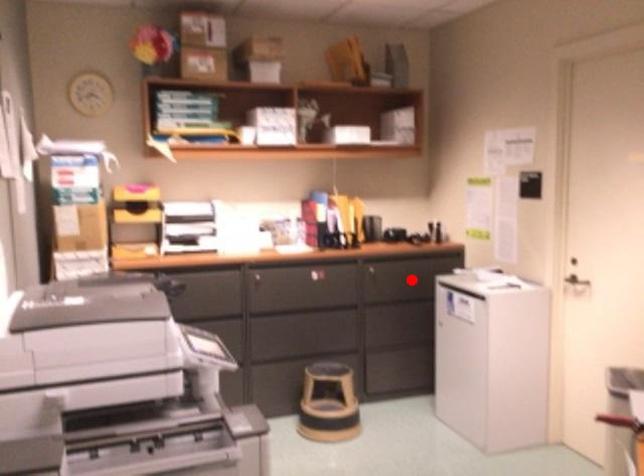
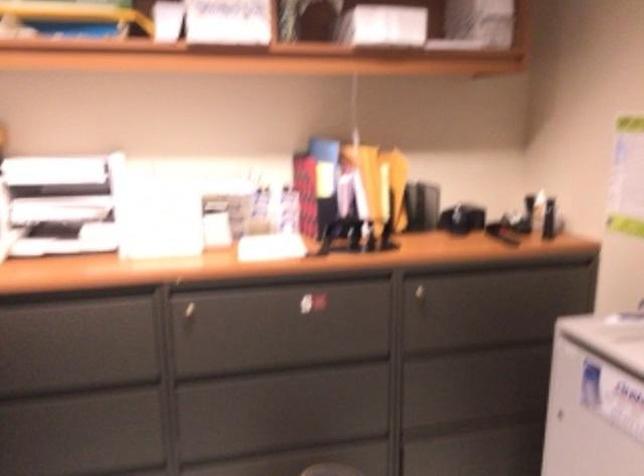
Question: I am providing you with two images of the same scene from different viewpoints. Image1 has a red point marked. In image2, the corresponding 3D location appears at what relative position? Reply with the corresponding letter.

Choices:
 (A) Closer
 (B) Farther

Answer: (A)